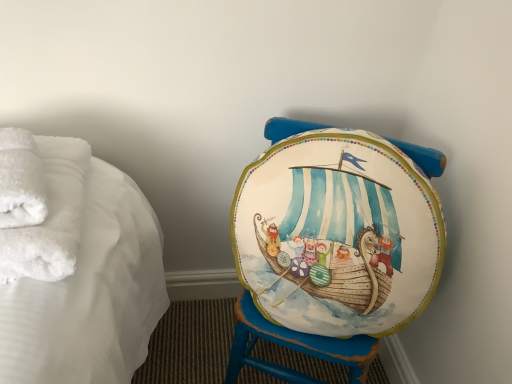
Image resolution: width=512 pixels, height=384 pixels. In order to click on matte painted stool at center in this screenshot , I will do `click(293, 347)`.

The image size is (512, 384). What are the coordinates of `white fluffy towels at left, the 1th bath towel positioned from the back` in the screenshot? It's located at (50, 217).

The width and height of the screenshot is (512, 384). What do you see at coordinates (21, 180) in the screenshot?
I see `white fluffy bath towel at left, the 2th bath towel in the back-to-front sequence` at bounding box center [21, 180].

Measure the distance between white fluffy bath towel at left, marked as the 1th bath towel in a front-to-back arrangement, and camera.

The distance of white fluffy bath towel at left, marked as the 1th bath towel in a front-to-back arrangement, from camera is 56.20 centimeters.

Where is `matte painted stool at center`? matte painted stool at center is located at coordinates (293, 347).

Considering the points (42, 199) and (53, 194), which point is in front, point (42, 199) or point (53, 194)?

Positioned in front is point (42, 199).

Find the location of a particular element. This screenshot has width=512, height=384. bath towel above the white fluffy towels at left, the 1th bath towel positioned from the back (from the image's perspective) is located at coordinates 21,180.

Does white fluffy bath towel at left, the 2th bath towel in the back-to-front sequence, appear on the left side of white fluffy towels at left, the 2th bath towel positioned from the front?

Yes.

Is white fluffy bath towel at left, marked as the 1th bath towel in a front-to-back arrangement, situated inside white fluffy towels at left, the 1th bath towel positioned from the back, or outside?

white fluffy bath towel at left, marked as the 1th bath towel in a front-to-back arrangement, is spatially situated outside white fluffy towels at left, the 1th bath towel positioned from the back.

Which object is closer to the camera taking this photo, white fluffy bath towel at left, the 2th bath towel in the back-to-front sequence, or matte painted stool at center?

white fluffy bath towel at left, the 2th bath towel in the back-to-front sequence.

From the image's perspective, is white fluffy bath towel at left, the 2th bath towel in the back-to-front sequence, on top of matte painted stool at center?

Indeed, from the image's perspective, white fluffy bath towel at left, the 2th bath towel in the back-to-front sequence, is shown above matte painted stool at center.

Considering the relative sizes of white fluffy bath towel at left, marked as the 1th bath towel in a front-to-back arrangement, and matte painted stool at center in the image provided, is white fluffy bath towel at left, marked as the 1th bath towel in a front-to-back arrangement, bigger than matte painted stool at center?

No, white fluffy bath towel at left, marked as the 1th bath towel in a front-to-back arrangement, is not bigger than matte painted stool at center.

Considering the positions of objects matte painted stool at center and white fluffy bath towel at left, the 2th bath towel in the back-to-front sequence, in the image provided, who is more to the right, matte painted stool at center or white fluffy bath towel at left, the 2th bath towel in the back-to-front sequence,?

matte painted stool at center.

Can you confirm if matte painted stool at center is bigger than white fluffy bath towel at left, marked as the 1th bath towel in a front-to-back arrangement?

Correct, matte painted stool at center is larger in size than white fluffy bath towel at left, marked as the 1th bath towel in a front-to-back arrangement.

From the image's perspective, which is above, matte painted stool at center or white fluffy bath towel at left, marked as the 1th bath towel in a front-to-back arrangement?

white fluffy bath towel at left, marked as the 1th bath towel in a front-to-back arrangement, is shown above in the image.

Is matte painted stool at center directly adjacent to white fluffy bath towel at left, marked as the 1th bath towel in a front-to-back arrangement?

No, matte painted stool at center is not beside white fluffy bath towel at left, marked as the 1th bath towel in a front-to-back arrangement.

Where is `the 1st bath towel positioned above the matte painted stool at center (from the image's perspective)`? Image resolution: width=512 pixels, height=384 pixels. the 1st bath towel positioned above the matte painted stool at center (from the image's perspective) is located at coordinates (50, 217).

Is matte painted stool at center placed right next to white fluffy towels at left, the 1th bath towel positioned from the back?

There is a gap between matte painted stool at center and white fluffy towels at left, the 1th bath towel positioned from the back.

From a real-world perspective, is matte painted stool at center beneath white fluffy towels at left, the 2th bath towel positioned from the front?

Yes, from a real-world perspective, matte painted stool at center is below white fluffy towels at left, the 2th bath towel positioned from the front.

How much distance is there between matte painted stool at center and white fluffy towels at left, the 2th bath towel positioned from the front?

A distance of 19.53 inches exists between matte painted stool at center and white fluffy towels at left, the 2th bath towel positioned from the front.

Which object is thinner, white fluffy towels at left, the 1th bath towel positioned from the back, or matte painted stool at center?

white fluffy towels at left, the 1th bath towel positioned from the back.

Choose the correct answer: Is white fluffy towels at left, the 2th bath towel positioned from the front, inside matte painted stool at center or outside it?

white fluffy towels at left, the 2th bath towel positioned from the front, cannot be found inside matte painted stool at center.

From a real-world perspective, relative to matte painted stool at center, is white fluffy towels at left, the 1th bath towel positioned from the back, vertically above or below?

In terms of real-world spatial position, white fluffy towels at left, the 1th bath towel positioned from the back, is above matte painted stool at center.

Who is taller, white fluffy towels at left, the 2th bath towel positioned from the front, or matte painted stool at center?

matte painted stool at center is taller.

Can we say white fluffy towels at left, the 1th bath towel positioned from the back, lies outside white fluffy bath towel at left, marked as the 1th bath towel in a front-to-back arrangement?

white fluffy towels at left, the 1th bath towel positioned from the back, is positioned outside white fluffy bath towel at left, marked as the 1th bath towel in a front-to-back arrangement.

From the image's perspective, is white fluffy towels at left, the 1th bath towel positioned from the back, located beneath white fluffy bath towel at left, the 2th bath towel in the back-to-front sequence?

Yes.

Considering their positions, is white fluffy towels at left, the 2th bath towel positioned from the front, located in front of or behind white fluffy bath towel at left, the 2th bath towel in the back-to-front sequence?

white fluffy towels at left, the 2th bath towel positioned from the front, is positioned farther from the viewer than white fluffy bath towel at left, the 2th bath towel in the back-to-front sequence.

Where is `bath towel below the white fluffy bath towel at left, the 2th bath towel in the back-to-front sequence (from the image's perspective)`? The image size is (512, 384). bath towel below the white fluffy bath towel at left, the 2th bath towel in the back-to-front sequence (from the image's perspective) is located at coordinates (50, 217).

Find the location of a particular element. the 2nd bath towel in front of the matte painted stool at center is located at coordinates (21, 180).

Based on their spatial positions, is white fluffy towels at left, the 2th bath towel positioned from the front, or matte painted stool at center closer to white fluffy bath towel at left, the 2th bath towel in the back-to-front sequence?

Among the two, white fluffy towels at left, the 2th bath towel positioned from the front, is located nearer to white fluffy bath towel at left, the 2th bath towel in the back-to-front sequence.

Looking at this image, from the image, which object appears to be nearer to white fluffy bath towel at left, the 2th bath towel in the back-to-front sequence, matte painted stool at center or white fluffy towels at left, the 1th bath towel positioned from the back?

white fluffy towels at left, the 1th bath towel positioned from the back, is closer to white fluffy bath towel at left, the 2th bath towel in the back-to-front sequence.

From the image, which object appears to be farther from white fluffy towels at left, the 2th bath towel positioned from the front, matte painted stool at center or white fluffy bath towel at left, marked as the 1th bath towel in a front-to-back arrangement?

matte painted stool at center lies further to white fluffy towels at left, the 2th bath towel positioned from the front, than the other object.

When comparing their distances from white fluffy towels at left, the 1th bath towel positioned from the back, does white fluffy bath towel at left, marked as the 1th bath towel in a front-to-back arrangement, or matte painted stool at center seem closer?

white fluffy bath towel at left, marked as the 1th bath towel in a front-to-back arrangement, lies closer to white fluffy towels at left, the 1th bath towel positioned from the back, than the other object.

When comparing their distances from matte painted stool at center, does white fluffy bath towel at left, the 2th bath towel in the back-to-front sequence, or white fluffy towels at left, the 1th bath towel positioned from the back, seem closer?

The object closer to matte painted stool at center is white fluffy towels at left, the 1th bath towel positioned from the back.

When comparing their distances from matte painted stool at center, does white fluffy towels at left, the 1th bath towel positioned from the back, or white fluffy bath towel at left, the 2th bath towel in the back-to-front sequence, seem further?

white fluffy bath towel at left, the 2th bath towel in the back-to-front sequence, is further to matte painted stool at center.

Identify the location of bath towel between white fluffy bath towel at left, the 2th bath towel in the back-to-front sequence, and matte painted stool at center. This screenshot has width=512, height=384. (50, 217).